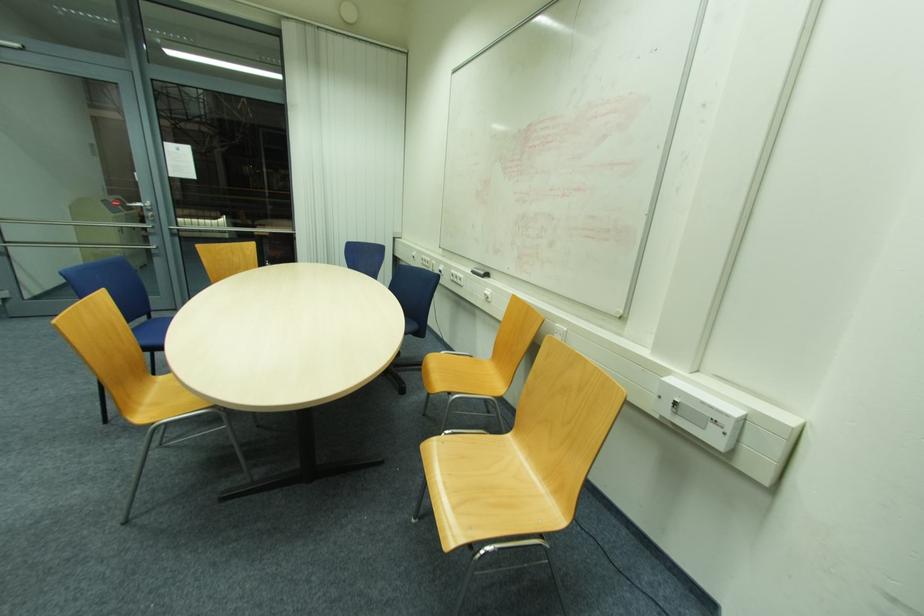
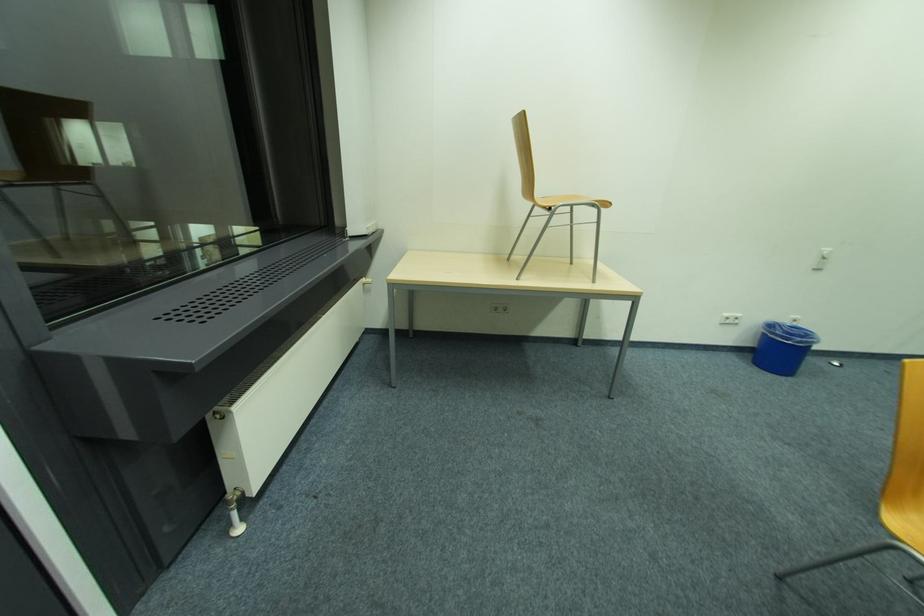
From the picture: How did the camera likely rotate?

The rotation direction of the camera is left-down.